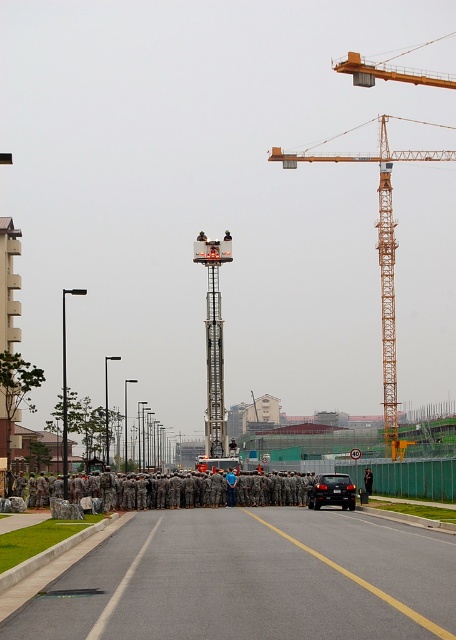
Is camouflage uniform at center to the left of black uniform construction worker at center from the viewer's perspective?

Yes, camouflage uniform at center is to the left of black uniform construction worker at center.

Is point (227, 472) closer to viewer compared to point (366, 490)?

No.

Where is `camouflage uniform at center`? camouflage uniform at center is located at coordinates (231, 486).

At what (x,y) coordinates should I click in order to perform the action: click on orange metallic crane at upper center. Please return your answer as a coordinate pair (x, y). The height and width of the screenshot is (640, 456). Looking at the image, I should click on (381, 260).

Which is behind, point (383, 376) or point (366, 467)?

Point (383, 376)

What do you see at coordinates (381, 260) in the screenshot? I see `orange metallic crane at upper center` at bounding box center [381, 260].

Find the location of a particular element. orange metallic crane at upper center is located at coordinates (381, 260).

Who is positioned more to the right, metallic gray tower crane at center or camouflage uniform at center?

camouflage uniform at center

Is point (223, 448) farther from camera compared to point (227, 490)?

Yes.

At what (x,y) coordinates should I click in order to perform the action: click on metallic gray tower crane at center. Please return your answer as a coordinate pair (x, y). This screenshot has height=640, width=456. Looking at the image, I should click on (213, 340).

You are a GUI agent. You are given a task and a screenshot of the screen. Output one action in this format:
    pyautogui.click(x=<x>, y=<y>)
    Task: Click on the metallic gray tower crane at center
    The width and height of the screenshot is (456, 640).
    Given the screenshot: What is the action you would take?
    pyautogui.click(x=213, y=340)